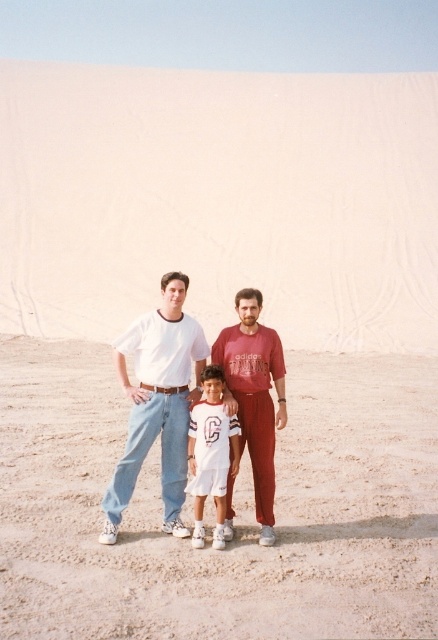
Question: Which of the following is the closest to the observer?

Choices:
 (A) (244, 301)
 (B) (176, 320)
 (C) (207, 380)
 (D) (204, 291)

Answer: (C)

Question: Does white sand dune at center have a smaller size compared to white cotton t-shirt at center?

Choices:
 (A) no
 (B) yes

Answer: (A)

Question: Considering the relative positions of white sand dune at center and brown sandy dirt at center in the image provided, where is white sand dune at center located with respect to brown sandy dirt at center?

Choices:
 (A) right
 (B) left

Answer: (B)

Question: Estimate the real-world distances between objects in this image. Which object is closer to the brown sandy dirt at center?

Choices:
 (A) white sand dune at center
 (B) white cotton shirt at center

Answer: (B)

Question: Which of the following is the farthest from the observer?

Choices:
 (A) white cotton shirt at center
 (B) brown sandy dirt at center
 (C) matte red t-shirt at center

Answer: (C)

Question: Is white sand dune at center closer to camera compared to matte red t-shirt at center?

Choices:
 (A) no
 (B) yes

Answer: (A)